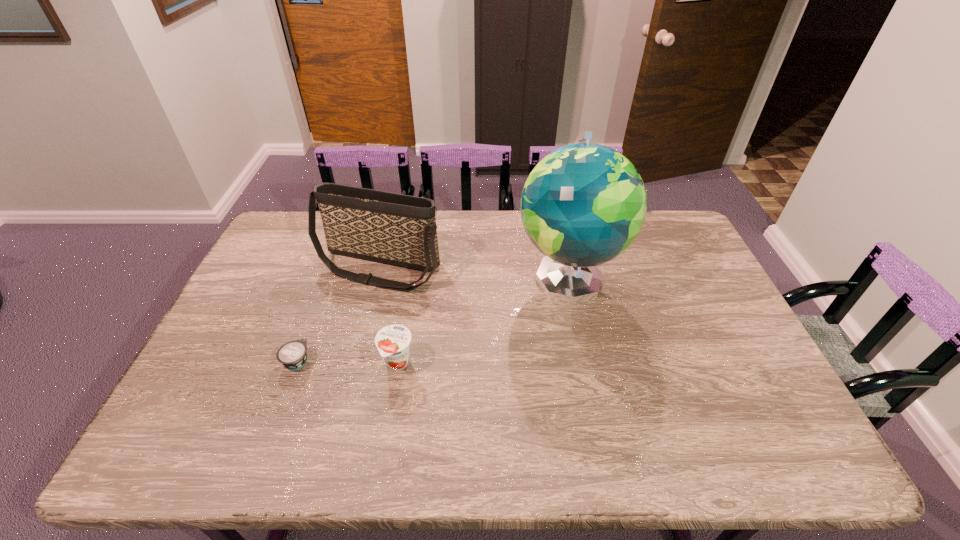
The image size is (960, 540). Identify the location of object that is the closest to the taller yogurt. (292, 355).

This screenshot has width=960, height=540. Identify the location of the third closest object relative to the shortest object. (584, 204).